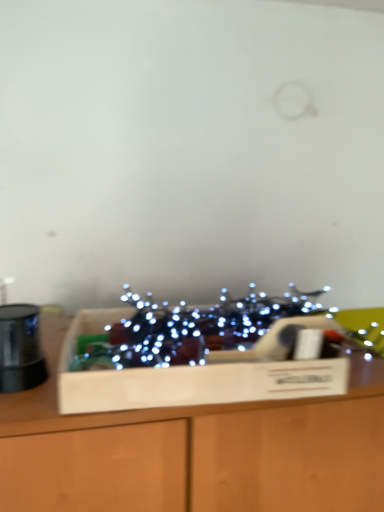
Question: From a real-world perspective, is wooden box at center on wooden box at center?

Choices:
 (A) no
 (B) yes

Answer: (B)

Question: From the image's perspective, is wooden box at center below wooden box at center?

Choices:
 (A) yes
 (B) no

Answer: (B)

Question: Does wooden box at center appear on the left side of wooden box at center?

Choices:
 (A) yes
 (B) no

Answer: (B)

Question: Is wooden box at center smaller than wooden box at center?

Choices:
 (A) yes
 (B) no

Answer: (A)

Question: Is wooden box at center shorter than wooden box at center?

Choices:
 (A) no
 (B) yes

Answer: (B)

Question: Based on their positions, is wooden box at center located to the left or right of illuminated string lights at center?

Choices:
 (A) left
 (B) right

Answer: (A)

Question: Is wooden box at center inside or outside of illuminated string lights at center?

Choices:
 (A) outside
 (B) inside

Answer: (A)

Question: Based on their sizes in the image, would you say wooden box at center is bigger or smaller than illuminated string lights at center?

Choices:
 (A) big
 (B) small

Answer: (A)

Question: Considering the positions of point (354, 492) and point (375, 339), is point (354, 492) closer or farther from the camera than point (375, 339)?

Choices:
 (A) closer
 (B) farther

Answer: (A)

Question: In terms of width, does wooden box at center look wider or thinner when compared to wooden box at center?

Choices:
 (A) thin
 (B) wide

Answer: (B)

Question: In terms of size, does wooden box at center appear bigger or smaller than wooden box at center?

Choices:
 (A) small
 (B) big

Answer: (B)

Question: From a real-world perspective, relative to wooden box at center, is wooden box at center vertically above or below?

Choices:
 (A) above
 (B) below

Answer: (B)

Question: Considering the positions of point (251, 485) and point (82, 329), is point (251, 485) closer or farther from the camera than point (82, 329)?

Choices:
 (A) farther
 (B) closer

Answer: (B)

Question: Looking at the image, does illuminated string lights at center seem bigger or smaller compared to wooden box at center?

Choices:
 (A) small
 (B) big

Answer: (A)

Question: Is illuminated string lights at center to the left or to the right of wooden box at center in the image?

Choices:
 (A) left
 (B) right

Answer: (B)